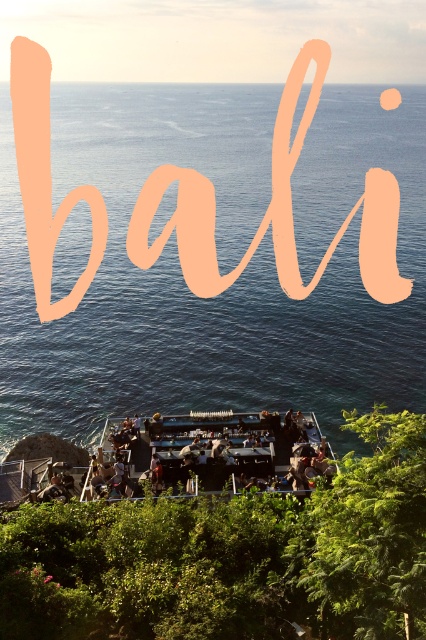
Question: Which point appears closest to the camera in this image?

Choices:
 (A) (147, 433)
 (B) (224, 300)

Answer: (A)

Question: Which object is farther from the camera taking this photo?

Choices:
 (A) metallic silver bar at center
 (B) blue water at upper center

Answer: (B)

Question: Considering the relative positions of blue water at upper center and metallic silver bar at center in the image provided, where is blue water at upper center located with respect to metallic silver bar at center?

Choices:
 (A) above
 (B) below

Answer: (A)

Question: Is blue water at upper center above metallic silver bar at center?

Choices:
 (A) yes
 (B) no

Answer: (A)

Question: Does blue water at upper center appear over metallic silver bar at center?

Choices:
 (A) no
 (B) yes

Answer: (B)